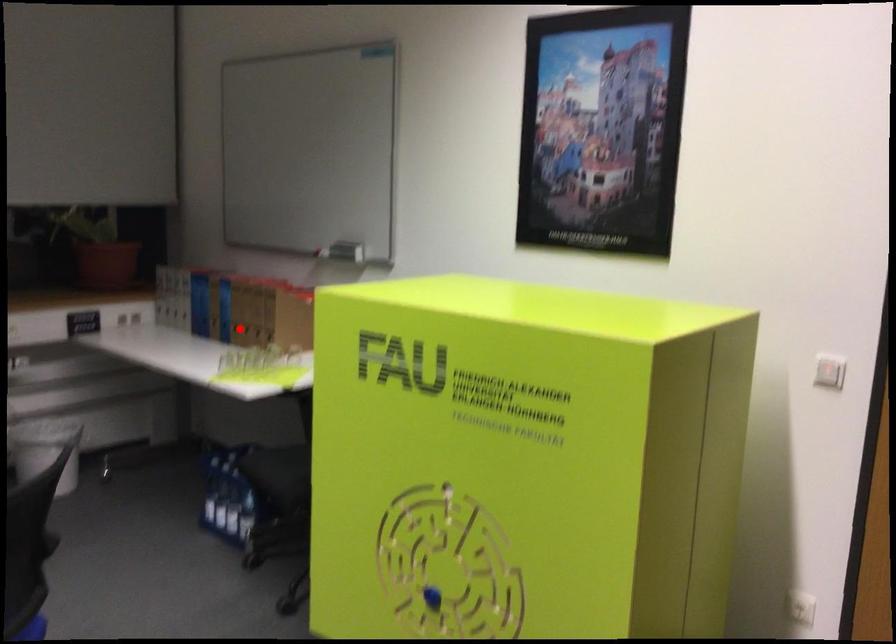
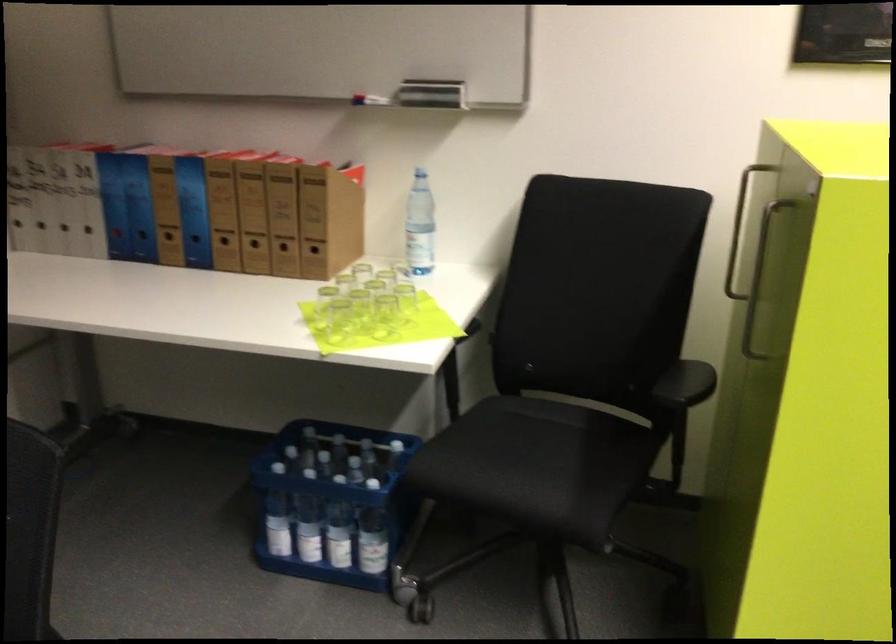
Locate, in the second image, the point that corresponds to the highlighted location in the first image.

(225, 245)